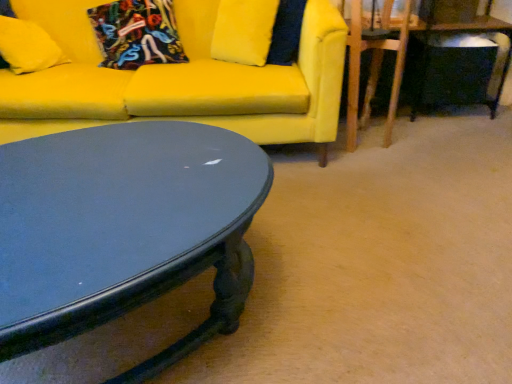
Question: Does point (173, 16) appear closer or farther from the camera than point (325, 67)?

Choices:
 (A) farther
 (B) closer

Answer: (A)

Question: Considering the positions of velvet floral pillow at upper left, acting as the 1th pillow starting from the right, and matte yellow couch at upper left in the image, is velvet floral pillow at upper left, acting as the 1th pillow starting from the right, taller or shorter than matte yellow couch at upper left?

Choices:
 (A) tall
 (B) short

Answer: (B)

Question: Which is nearer to the wooden swivel chair at right?

Choices:
 (A) matte yellow couch at upper left
 (B) matte yellow pillow at upper left, the second pillow positioned from the right
 (C) velvet floral pillow at upper left, placed as the 2th pillow when sorted from left to right
 (D) matte black table at lower right
 (E) glossy dark wood coffee table at lower left

Answer: (D)

Question: Which is nearer to the wooden swivel chair at right?

Choices:
 (A) matte yellow pillow at upper left, marked as the 1th pillow in a left-to-right arrangement
 (B) velvet floral pillow at upper left, acting as the 1th pillow starting from the right
 (C) glossy dark wood coffee table at lower left
 (D) matte yellow couch at upper left
 (E) matte black table at lower right

Answer: (E)